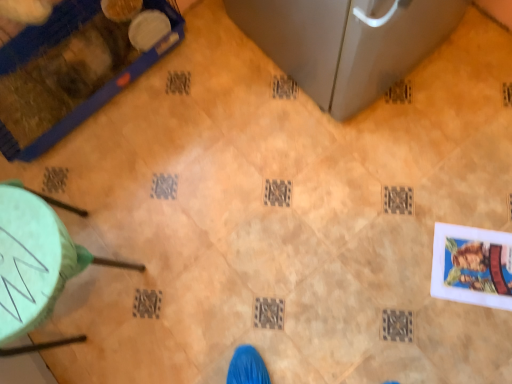
Question: Considering the relative sizes of blue plastic pet cage at upper left, which is the 2th furniture in bottom-to-top order, and green plastic stool at lower left, the 2th furniture in the top-to-bottom sequence, in the image provided, is blue plastic pet cage at upper left, which is the 2th furniture in bottom-to-top order, shorter than green plastic stool at lower left, the 2th furniture in the top-to-bottom sequence,?

Choices:
 (A) yes
 (B) no

Answer: (A)

Question: From a real-world perspective, does blue plastic pet cage at upper left, which appears as the first furniture when viewed from the top, stand above green plastic stool at lower left, placed as the first furniture when sorted from bottom to top?

Choices:
 (A) no
 (B) yes

Answer: (A)

Question: Is blue plastic pet cage at upper left, which is the 2th furniture in bottom-to-top order, wider than green plastic stool at lower left, placed as the first furniture when sorted from bottom to top?

Choices:
 (A) no
 (B) yes

Answer: (B)

Question: Is blue plastic pet cage at upper left, which is the 2th furniture in bottom-to-top order, not close to green plastic stool at lower left, placed as the first furniture when sorted from bottom to top?

Choices:
 (A) no
 (B) yes

Answer: (A)

Question: Can you confirm if blue plastic pet cage at upper left, which is the 2th furniture in bottom-to-top order, is smaller than green plastic stool at lower left, the 2th furniture in the top-to-bottom sequence?

Choices:
 (A) yes
 (B) no

Answer: (B)

Question: Can you confirm if blue plastic pet cage at upper left, which appears as the first furniture when viewed from the top, is thinner than green plastic stool at lower left, placed as the first furniture when sorted from bottom to top?

Choices:
 (A) yes
 (B) no

Answer: (B)

Question: Is green plastic stool at lower left, the 2th furniture in the top-to-bottom sequence, facing away from blue plastic pet cage at upper left, which is the 2th furniture in bottom-to-top order?

Choices:
 (A) yes
 (B) no

Answer: (B)

Question: From the image's perspective, is green plastic stool at lower left, the 2th furniture in the top-to-bottom sequence, located above blue plastic pet cage at upper left, which appears as the first furniture when viewed from the top?

Choices:
 (A) yes
 (B) no

Answer: (B)

Question: Are green plastic stool at lower left, placed as the first furniture when sorted from bottom to top, and blue plastic pet cage at upper left, which appears as the first furniture when viewed from the top, making contact?

Choices:
 (A) yes
 (B) no

Answer: (B)

Question: Is green plastic stool at lower left, the 2th furniture in the top-to-bottom sequence, to the left of blue plastic pet cage at upper left, which is the 2th furniture in bottom-to-top order, from the viewer's perspective?

Choices:
 (A) yes
 (B) no

Answer: (B)

Question: Does green plastic stool at lower left, placed as the first furniture when sorted from bottom to top, come in front of blue plastic pet cage at upper left, which is the 2th furniture in bottom-to-top order?

Choices:
 (A) no
 (B) yes

Answer: (B)

Question: Does green plastic stool at lower left, the 2th furniture in the top-to-bottom sequence, have a lesser height compared to blue plastic pet cage at upper left, which appears as the first furniture when viewed from the top?

Choices:
 (A) no
 (B) yes

Answer: (A)

Question: Visually, is blue plastic pet cage at upper left, which is the 2th furniture in bottom-to-top order, positioned to the left or to the right of green plastic stool at lower left, the 2th furniture in the top-to-bottom sequence?

Choices:
 (A) right
 (B) left

Answer: (B)